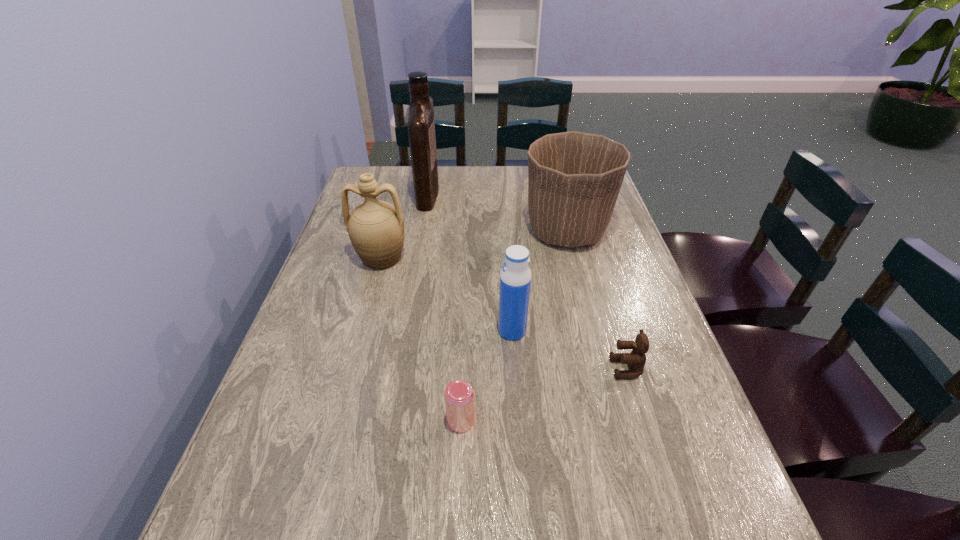
Where is `object that is the fourth closest to the tallest object`? object that is the fourth closest to the tallest object is located at coordinates (459, 395).

The height and width of the screenshot is (540, 960). In order to click on free space that satisfies the following two spatial constraints: 1. on the label side of the tallest object; 2. on the right side of the flowerpot in this screenshot , I will do `click(421, 231)`.

At what (x,y) coordinates should I click in order to perform the action: click on vacant space that satisfies the following two spatial constraints: 1. on the label side of the liquor; 2. on the front side of the pitcher. Please return your answer as a coordinate pair (x, y). This screenshot has width=960, height=540. Looking at the image, I should click on (417, 258).

This screenshot has height=540, width=960. I want to click on vacant region that satisfies the following two spatial constraints: 1. on the back side of the nearest object; 2. on the right side of the fourth farthest object, so click(464, 331).

Find the location of a particular element. The width and height of the screenshot is (960, 540). blank space that satisfies the following two spatial constraints: 1. on the label side of the flowerpot; 2. on the right side of the tallest object is located at coordinates click(421, 231).